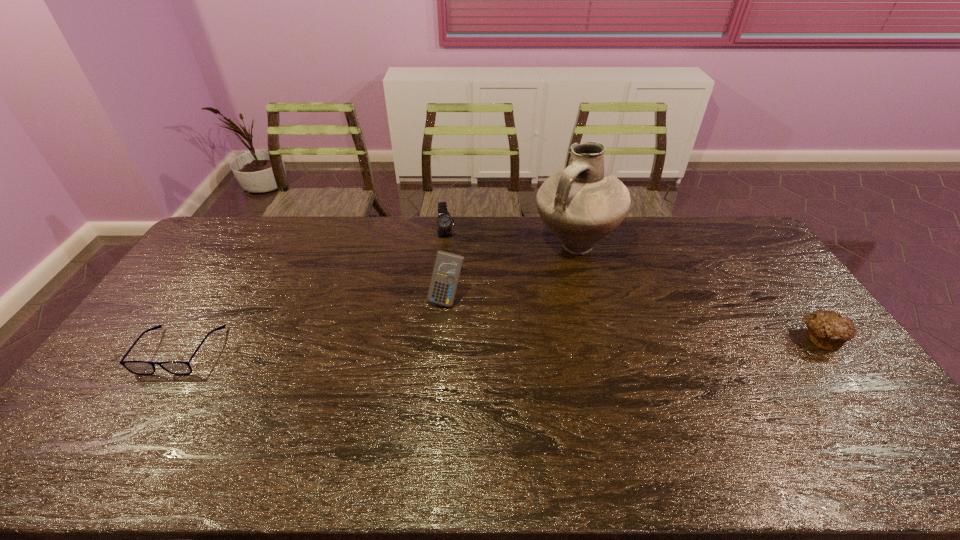
Locate which object ranks in proximity to the fourth tallest object. Please provide its 2D coordinates. Your answer should be formatted as a tuple, i.e. [(x, y)], where the tuple contains the x and y coordinates of a point satisfying the conditions above.

[(581, 204)]

Where is `object that is the third closest one to the calculator`? The image size is (960, 540). object that is the third closest one to the calculator is located at coordinates (136, 367).

The width and height of the screenshot is (960, 540). I want to click on free space that satisfies the following two spatial constraints: 1. on the front side of the watch; 2. on the left side of the muffin, so click(436, 338).

Find the location of a particular element. Image resolution: width=960 pixels, height=540 pixels. vacant space that satisfies the following two spatial constraints: 1. on the front side of the tallest object; 2. on the left side of the muffin is located at coordinates click(x=598, y=338).